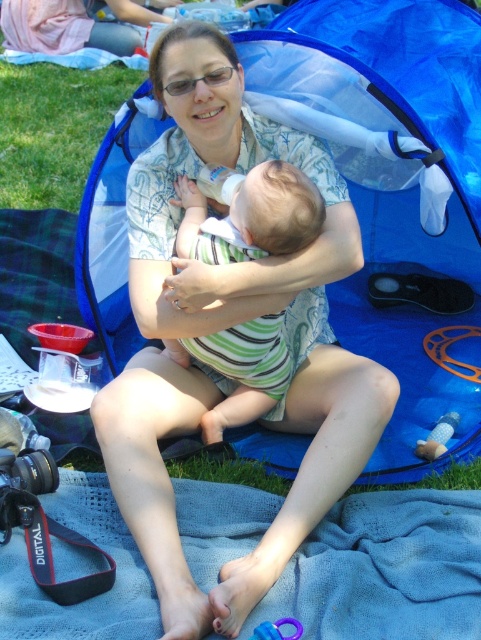
You are a photographer taking a picture of the picnic scene. You notice two points in the image at coordinates point (206, 316) and point (289, 188). Which point will appear closer to the camera in the photo?

Point (289, 188) will appear closer to the camera in the photo because it is closer to the viewer than point (206, 316), which is further away.